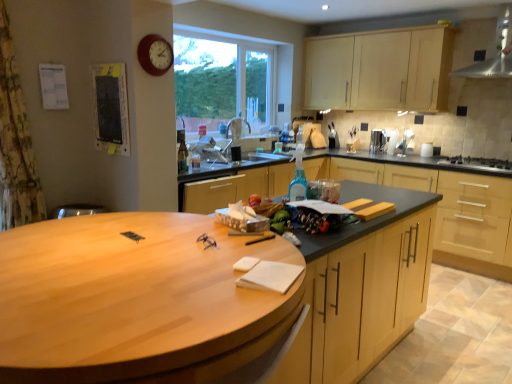
The width and height of the screenshot is (512, 384). What are the coordinates of `matte black bulletin board at upper left` in the screenshot? It's located at (111, 108).

What do you see at coordinates (111, 108) in the screenshot? Image resolution: width=512 pixels, height=384 pixels. I see `matte black bulletin board at upper left` at bounding box center [111, 108].

At what (x,y) coordinates should I click in order to perform the action: click on wooden clock at upper left. Please return your answer as a coordinate pair (x, y). The width and height of the screenshot is (512, 384). Looking at the image, I should click on (155, 54).

The height and width of the screenshot is (384, 512). Describe the element at coordinates (478, 162) in the screenshot. I see `black stainless steel gas stove at right` at that location.

What do you see at coordinates (380, 70) in the screenshot? This screenshot has height=384, width=512. I see `light wood cabinet at upper right, the 1th cabinetry when ordered from top to bottom` at bounding box center [380, 70].

Describe the element at coordinates (232, 146) in the screenshot. I see `black matte sink at center` at that location.

In order to click on matte black bulletin board at upper left in this screenshot , I will do `click(111, 108)`.

Consider the image. Does satin silver kettle at upper right have a smaller size compared to wooden clock at upper left?

Actually, satin silver kettle at upper right might be larger than wooden clock at upper left.

Based on the photo, from the image's perspective, is satin silver kettle at upper right beneath wooden clock at upper left?

Yes, from the image's perspective, satin silver kettle at upper right is beneath wooden clock at upper left.

Based on the photo, which object is further away from the camera taking this photo, satin silver kettle at upper right or wooden clock at upper left?

satin silver kettle at upper right is further away from the camera.

Is satin silver kettle at upper right inside or outside of wooden clock at upper left?

The correct answer is: outside.

Considering the relative sizes of wooden clock at upper left and wooden at center in the image provided, is wooden clock at upper left smaller than wooden at center?

Yes.

In the scene shown: Is wooden clock at upper left looking in the opposite direction of wooden at center?

No, wooden at center is not at the back of wooden clock at upper left.

Is wooden clock at upper left in front of or behind wooden at center in the image?

wooden clock at upper left is behind wooden at center.

How different are the orientations of wooden clock at upper left and wooden at center in degrees?

The angular difference between wooden clock at upper left and wooden at center is 87.3 degrees.

Considering the sizes of objects matte wood cabinets at center, the 1th cabinetry from the bottom, and black stainless steel gas stove at right in the image provided, who is shorter, matte wood cabinets at center, the 1th cabinetry from the bottom, or black stainless steel gas stove at right?

black stainless steel gas stove at right is shorter.

Does matte wood cabinets at center, the 1th cabinetry from the bottom, have a smaller size compared to black stainless steel gas stove at right?

Actually, matte wood cabinets at center, the 1th cabinetry from the bottom, might be larger than black stainless steel gas stove at right.

From a real-world perspective, is matte wood cabinets at center, the 2th cabinetry in the top-to-bottom sequence, above or below black stainless steel gas stove at right?

From a real-world perspective, matte wood cabinets at center, the 2th cabinetry in the top-to-bottom sequence, is physically below black stainless steel gas stove at right.

Is point (479, 256) closer or farther from the camera than point (456, 157)?

Clearly, point (479, 256) is closer to the camera than point (456, 157).

From the image's perspective, is stainless steel exhaust hood at upper right on top of matte wood cabinets at center, the 2th cabinetry in the top-to-bottom sequence?

Yes.

Is stainless steel exhaust hood at upper right completely or partially outside of matte wood cabinets at center, the 2th cabinetry in the top-to-bottom sequence?

Yes, stainless steel exhaust hood at upper right is outside of matte wood cabinets at center, the 2th cabinetry in the top-to-bottom sequence.

Which is nearer, [495,64] or [226,174]?

Point [495,64] is farther from the camera than point [226,174].

Where is `cabinetry that is below the black matte sink at center (from the image's perspective)`? cabinetry that is below the black matte sink at center (from the image's perspective) is located at coordinates (x=442, y=204).

Is black matte sink at center oriented towards matte wood cabinets at center, the 2th cabinetry in the top-to-bottom sequence?

No, black matte sink at center is not facing towards matte wood cabinets at center, the 2th cabinetry in the top-to-bottom sequence.

Consider the image. Is black matte sink at center to the left of matte wood cabinets at center, the 1th cabinetry from the bottom, from the viewer's perspective?

Yes, black matte sink at center is to the left of matte wood cabinets at center, the 1th cabinetry from the bottom.

Is black matte sink at center far away from matte wood cabinets at center, the 2th cabinetry in the top-to-bottom sequence?

Yes, black matte sink at center is far from matte wood cabinets at center, the 2th cabinetry in the top-to-bottom sequence.

Is matte black bulletin board at upper left directly adjacent to black stainless steel gas stove at right?

matte black bulletin board at upper left and black stainless steel gas stove at right are clearly separated.

The width and height of the screenshot is (512, 384). Find the location of `bulletin board on the left of black stainless steel gas stove at right`. bulletin board on the left of black stainless steel gas stove at right is located at coordinates (111, 108).

Considering the relative sizes of matte black bulletin board at upper left and black stainless steel gas stove at right in the image provided, is matte black bulletin board at upper left smaller than black stainless steel gas stove at right?

No.

Considering their positions, is matte black bulletin board at upper left located in front of or behind black stainless steel gas stove at right?

Clearly, matte black bulletin board at upper left is in front of black stainless steel gas stove at right.

Can you confirm if floral fabric curtain at left is positioned to the right of wooden at center?

No.

I want to click on countertop below the floral fabric curtain at left (from a real-world perspective), so click(199, 298).

Which is correct: floral fabric curtain at left is inside wooden at center, or outside of it?

The correct answer is: outside.

Which is further, (x=9, y=23) or (x=167, y=303)?

The point (x=9, y=23) is farther.

Locate an element on the screen. appliance that appears behind the wooden clock at upper left is located at coordinates (377, 141).

This screenshot has height=384, width=512. I want to click on clock that is on the left side of wooden at center, so click(155, 54).

Looking at the image, which one is located closer to light wood cabinet at upper right, the 1th cabinetry when ordered from top to bottom, wooden clock at upper left or floral fabric curtain at left?

Based on the image, wooden clock at upper left appears to be nearer to light wood cabinet at upper right, the 1th cabinetry when ordered from top to bottom.

Considering their positions, is wooden clock at upper left positioned closer to black stainless steel gas stove at right than stainless steel exhaust hood at upper right?

stainless steel exhaust hood at upper right is positioned closer to the anchor black stainless steel gas stove at right.

Estimate the real-world distances between objects in this image. Which object is closer to floral fabric curtain at left, stainless steel exhaust hood at upper right or matte wood cabinets at center, the 1th cabinetry from the bottom?

Based on the image, matte wood cabinets at center, the 1th cabinetry from the bottom, appears to be nearer to floral fabric curtain at left.

Based on their spatial positions, is black matte sink at center or wooden at center further from satin silver kettle at upper right?

Based on the image, wooden at center appears to be further to satin silver kettle at upper right.

Based on their spatial positions, is black matte sink at center or matte black bulletin board at upper left closer to satin silver kettle at upper right?

Based on the image, black matte sink at center appears to be nearer to satin silver kettle at upper right.

When comparing their distances from stainless steel exhaust hood at upper right, does black matte sink at center or wooden at center seem further?

The object further to stainless steel exhaust hood at upper right is wooden at center.

From the image, which object appears to be nearer to wooden at center, stainless steel exhaust hood at upper right or matte wood cabinets at center, the 2th cabinetry in the top-to-bottom sequence?

matte wood cabinets at center, the 2th cabinetry in the top-to-bottom sequence.

Based on the photo, looking at the image, which one is located further to matte black bulletin board at upper left, light wood cabinet at upper right, which appears as the second cabinetry when ordered from the bottom, or matte wood cabinets at center, the 1th cabinetry from the bottom?

Among the two, light wood cabinet at upper right, which appears as the second cabinetry when ordered from the bottom, is located further to matte black bulletin board at upper left.

This screenshot has width=512, height=384. I want to click on cabinetry situated between floral fabric curtain at left and matte wood cabinets at center, the 1th cabinetry from the bottom, from left to right, so click(380, 70).

In order to click on countertop between wooden clock at upper left and black stainless steel gas stove at right from left to right in this screenshot , I will do `click(199, 298)`.

The width and height of the screenshot is (512, 384). Identify the location of exhaust hood located between wooden clock at upper left and black stainless steel gas stove at right in the left-right direction. (495, 52).

Locate an element on the screen. The height and width of the screenshot is (384, 512). gas stove between light wood cabinet at upper right, the 1th cabinetry when ordered from top to bottom, and matte wood cabinets at center, the 2th cabinetry in the top-to-bottom sequence, in the up-down direction is located at coordinates (478, 162).